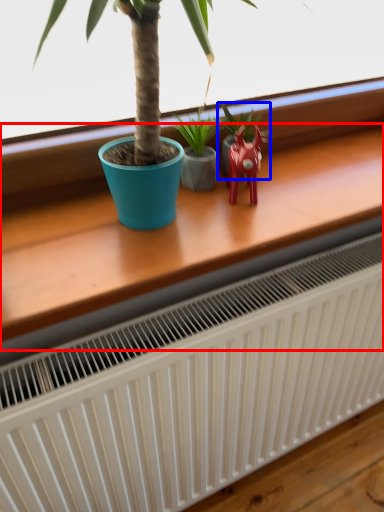
Question: Among these objects, which one is nearest to the camera, table (highlighted by a red box) or houseplant (highlighted by a blue box)?

Choices:
 (A) table
 (B) houseplant

Answer: (A)